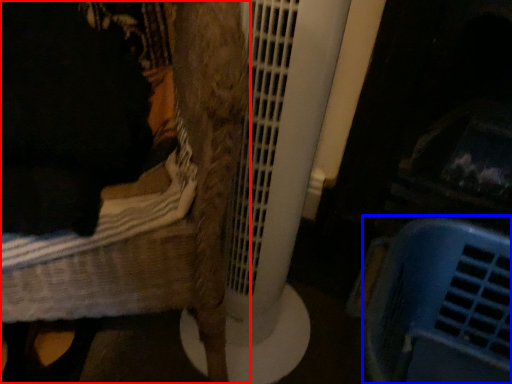
Question: Which object is further to the camera taking this photo, furniture (highlighted by a red box) or basket (highlighted by a blue box)?

Choices:
 (A) furniture
 (B) basket

Answer: (B)